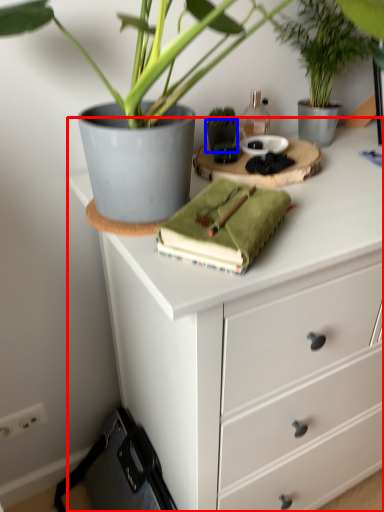
Question: Among these objects, which one is nearest to the camera, chest of drawers (highlighted by a red box) or flowerpot (highlighted by a blue box)?

Choices:
 (A) chest of drawers
 (B) flowerpot

Answer: (A)